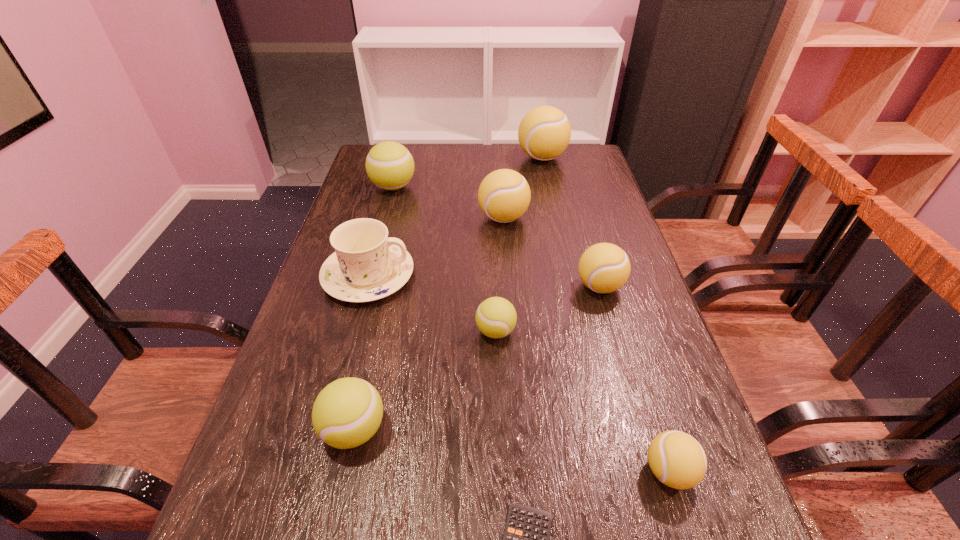
The width and height of the screenshot is (960, 540). Identify the location of tennis ball object that ranks as the third closest to the nearest green tennis ball. (604, 267).

Locate an element on the screen. The width and height of the screenshot is (960, 540). tennis ball that is the fourth closest to the nearest yellow tennis ball is located at coordinates (504, 195).

Point out which yellow tennis ball is positioned as the third nearest to the sixth nearest tennis ball. Please provide its 2D coordinates. Your answer should be formatted as a tuple, i.e. [(x, y)], where the tuple contains the x and y coordinates of a point satisfying the conditions above.

[(604, 267)]

Identify which yellow tennis ball is the second nearest to the third smallest yellow tennis ball. Please provide its 2D coordinates. Your answer should be formatted as a tuple, i.e. [(x, y)], where the tuple contains the x and y coordinates of a point satisfying the conditions above.

[(544, 133)]

What are the coordinates of `green tennis ball identified as the closest to the sixth farthest object` in the screenshot? It's located at (347, 412).

Where is `green tennis ball that is the closest one to the second biggest green tennis ball`? The width and height of the screenshot is (960, 540). green tennis ball that is the closest one to the second biggest green tennis ball is located at coordinates (496, 317).

Locate an element on the screen. The image size is (960, 540). vacant space that satisfies the following two spatial constraints: 1. on the back side of the rightmost green tennis ball; 2. on the left side of the nearest green tennis ball is located at coordinates (376, 331).

The height and width of the screenshot is (540, 960). I want to click on vacant position in the image that satisfies the following two spatial constraints: 1. on the front side of the fifth nearest tennis ball; 2. on the right side of the nearest yellow tennis ball, so click(x=520, y=471).

Identify the location of vacant space that satisfies the following two spatial constraints: 1. on the back side of the farthest tennis ball; 2. on the left side of the third smallest yellow tennis ball. (499, 158).

Image resolution: width=960 pixels, height=540 pixels. Identify the location of vacant space that satisfies the following two spatial constraints: 1. on the back side of the second biggest green tennis ball; 2. on the right side of the fifth nearest tennis ball. (401, 218).